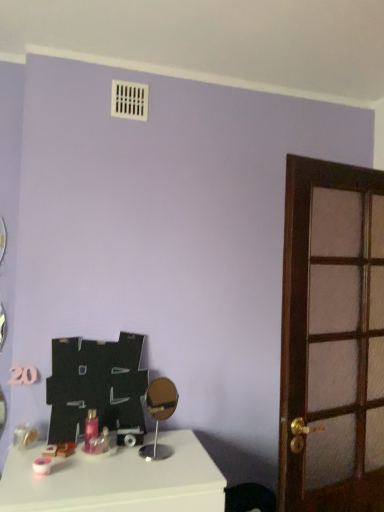
This screenshot has height=512, width=384. Identify the location of free spot above white glossy table at lower left (from a real-world perspective). (128, 454).